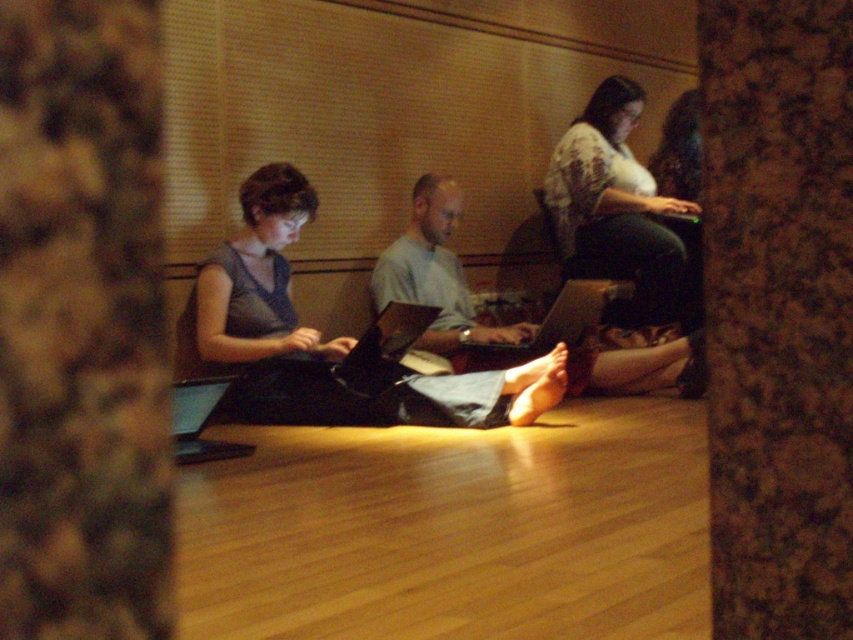
Who is shorter, matte black laptop at center or shiny black laptop at center?

shiny black laptop at center

Is matte black laptop at center to the left of shiny black laptop at center from the viewer's perspective?

Indeed, matte black laptop at center is positioned on the left side of shiny black laptop at center.

Does point (236, 243) come farther from viewer compared to point (531, 340)?

No.

Image resolution: width=853 pixels, height=640 pixels. I want to click on matte black laptop at center, so click(329, 339).

Which is in front, point (676, 260) or point (581, 333)?

Point (581, 333)

What do you see at coordinates (614, 205) in the screenshot?
I see `patterned fabric shirt at upper right` at bounding box center [614, 205].

Find the location of a particular element. patterned fabric shirt at upper right is located at coordinates (614, 205).

Does matte black laptop at center have a greater height compared to black glossy laptop at lower left?

Yes, matte black laptop at center is taller than black glossy laptop at lower left.

I want to click on matte black laptop at center, so click(329, 339).